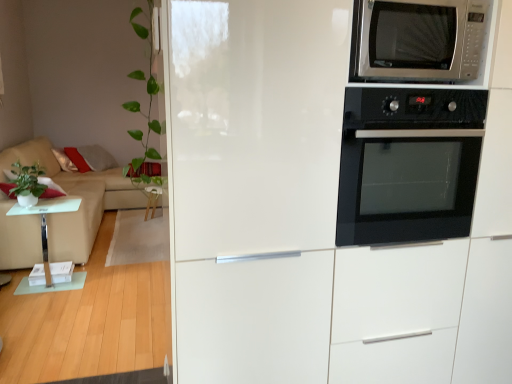
Where is `black glass oven at upper right`? black glass oven at upper right is located at coordinates (408, 164).

Find the location of a particular element. beige fabric couch at left is located at coordinates (75, 194).

The width and height of the screenshot is (512, 384). Find the location of `green leafy plant at left, which ranks as the 1th plant in right-to-left order`. green leafy plant at left, which ranks as the 1th plant in right-to-left order is located at coordinates (147, 111).

Is white glossy fridge at upper right taller or shorter than green matte plant at left, which appears as the second plant when viewed from the front?

Clearly, white glossy fridge at upper right is taller compared to green matte plant at left, which appears as the second plant when viewed from the front.

Locate an element on the screen. This screenshot has height=384, width=512. fridge above the green matte plant at left, the first plant when ordered from left to right (from a real-world perspective) is located at coordinates (254, 185).

Considering the relative positions of white glossy fridge at upper right and green matte plant at left, the first plant when ordered from left to right, in the image provided, is white glossy fridge at upper right to the left of green matte plant at left, the first plant when ordered from left to right, from the viewer's perspective?

Incorrect, white glossy fridge at upper right is not on the left side of green matte plant at left, the first plant when ordered from left to right.

From a real-world perspective, between white glossy fridge at upper right and green matte plant at left, which appears as the second plant when viewed from the front, who is vertically lower?

From a 3D spatial view, green matte plant at left, which appears as the second plant when viewed from the front, is below.

Considering the sizes of objects transparent glass table at left and black glass oven at upper right in the image provided, who is wider, transparent glass table at left or black glass oven at upper right?

transparent glass table at left is wider.

Between transparent glass table at left and black glass oven at upper right, which one appears on the left side from the viewer's perspective?

transparent glass table at left is more to the left.

At what (x,y) coordinates should I click in order to perform the action: click on table below the black glass oven at upper right (from the image's perspective). Please return your answer as a coordinate pair (x, y). This screenshot has width=512, height=384. Looking at the image, I should click on (46, 222).

Is beige fabric couch at left turned away from white glossy fridge at upper right?

beige fabric couch at left does not have its back to white glossy fridge at upper right.

From the image's perspective, does beige fabric couch at left appear higher than white glossy fridge at upper right?

Correct, beige fabric couch at left appears higher than white glossy fridge at upper right in the image.

Can you see beige fabric couch at left touching white glossy fridge at upper right?

beige fabric couch at left is not next to white glossy fridge at upper right, and they're not touching.

Is satin silver microwave at upper right positioned far away from transparent glass table at left?

That's right, there is a large distance between satin silver microwave at upper right and transparent glass table at left.

Is satin silver microwave at upper right facing towards transparent glass table at left?

No.

From the image's perspective, would you say satin silver microwave at upper right is shown under transparent glass table at left?

No.

Find the location of a particular element. Image resolution: width=512 pixels, height=384 pixels. microwave oven that is in front of the transparent glass table at left is located at coordinates (417, 40).

From a real-world perspective, is white glossy fridge at upper right over satin silver microwave at upper right?

No, from a real-world perspective, white glossy fridge at upper right is not above satin silver microwave at upper right.

Which is closer, (285, 38) or (370, 22)?

Clearly, point (285, 38) is closer to the camera than point (370, 22).

How different are the orientations of white glossy fridge at upper right and satin silver microwave at upper right in degrees?

The facing directions of white glossy fridge at upper right and satin silver microwave at upper right are 0.05 degrees apart.

Where is `table below the green leafy plant at left, which ranks as the first plant in front-to-back order (from a real-world perspective)`? table below the green leafy plant at left, which ranks as the first plant in front-to-back order (from a real-world perspective) is located at coordinates (46, 222).

Does transparent glass table at left turn towards green leafy plant at left, which is counted as the 2th plant, starting from the back?

No, transparent glass table at left is not turned towards green leafy plant at left, which is counted as the 2th plant, starting from the back.

Is transparent glass table at left to the left of green leafy plant at left, which is counted as the 2th plant, starting from the back, from the viewer's perspective?

Yes, transparent glass table at left is to the left of green leafy plant at left, which is counted as the 2th plant, starting from the back.

Is the depth of transparent glass table at left less than that of green leafy plant at left, which ranks as the first plant in front-to-back order?

That is False.

Considering the positions of objects green leafy plant at left, which ranks as the first plant in front-to-back order, and black glass oven at upper right in the image provided, who is behind, green leafy plant at left, which ranks as the first plant in front-to-back order, or black glass oven at upper right?

Positioned behind is green leafy plant at left, which ranks as the first plant in front-to-back order.

From a real-world perspective, who is located lower, green leafy plant at left, which ranks as the 1th plant in right-to-left order, or black glass oven at upper right?

In real-world perspective, black glass oven at upper right is lower.

How different are the orientations of green leafy plant at left, which appears as the second plant when viewed from the left, and black glass oven at upper right in degrees?

There is a 179-degree angle between the facing directions of green leafy plant at left, which appears as the second plant when viewed from the left, and black glass oven at upper right.

Is point (150, 8) closer or farther from the camera than point (469, 91)?

Point (150, 8) is positioned farther from the camera compared to point (469, 91).

The height and width of the screenshot is (384, 512). In order to click on fridge that appears above the green matte plant at left, which is the 2th plant from right to left (from a real-world perspective) in this screenshot , I will do `click(254, 185)`.

The image size is (512, 384). I want to click on oven that is above the transparent glass table at left (from the image's perspective), so click(408, 164).

Considering their positions, is black glass oven at upper right positioned further to white glossy fridge at upper right than satin silver microwave at upper right?

satin silver microwave at upper right is positioned further to the anchor white glossy fridge at upper right.

Estimate the real-world distances between objects in this image. Which object is further from green matte plant at left, which is the 2th plant from right to left, green leafy plant at left, which is counted as the 2th plant, starting from the back, or black glass oven at upper right?

Among the two, black glass oven at upper right is located further to green matte plant at left, which is the 2th plant from right to left.

When comparing their distances from beige fabric couch at left, does green matte plant at left, which appears as the second plant when viewed from the front, or white glossy fridge at upper right seem further?

The object further to beige fabric couch at left is white glossy fridge at upper right.

From the image, which object appears to be farther from green matte plant at left, the first plant when ordered from left to right, green leafy plant at left, which ranks as the first plant in front-to-back order, or beige fabric couch at left?

green leafy plant at left, which ranks as the first plant in front-to-back order, lies further to green matte plant at left, the first plant when ordered from left to right, than the other object.

When comparing their distances from green matte plant at left, the first plant when ordered from left to right, does transparent glass table at left or black glass oven at upper right seem further?

black glass oven at upper right lies further to green matte plant at left, the first plant when ordered from left to right, than the other object.

Which object lies further to the anchor point satin silver microwave at upper right, green leafy plant at left, which ranks as the first plant in front-to-back order, or green matte plant at left, positioned as the first plant in back-to-front order?

green matte plant at left, positioned as the first plant in back-to-front order, is further to satin silver microwave at upper right.

Consider the image. Based on their spatial positions, is transparent glass table at left or beige fabric couch at left closer to white glossy fridge at upper right?

Among the two, transparent glass table at left is located nearer to white glossy fridge at upper right.

Looking at the image, which one is located closer to beige fabric couch at left, satin silver microwave at upper right or black glass oven at upper right?

Among the two, black glass oven at upper right is located nearer to beige fabric couch at left.

Find the location of a particular element. This screenshot has height=384, width=512. table situated between green matte plant at left, which appears as the second plant when viewed from the front, and black glass oven at upper right from left to right is located at coordinates (46, 222).

At what (x,y) coordinates should I click in order to perform the action: click on plant between transparent glass table at left and satin silver microwave at upper right in the horizontal direction. Please return your answer as a coordinate pair (x, y). The image size is (512, 384). Looking at the image, I should click on (147, 111).

Where is `microwave oven between transparent glass table at left and black glass oven at upper right from left to right`? The width and height of the screenshot is (512, 384). microwave oven between transparent glass table at left and black glass oven at upper right from left to right is located at coordinates (417, 40).

Locate an element on the screen. This screenshot has width=512, height=384. microwave oven located between beige fabric couch at left and black glass oven at upper right in the left-right direction is located at coordinates [x=417, y=40].